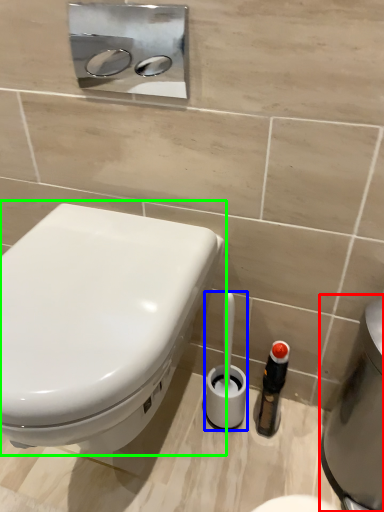
Question: Estimate the real-world distances between objects in this image. Which object is closer to water heater (highlighted by a red box), brush (highlighted by a blue box) or toilet (highlighted by a green box)?

Choices:
 (A) brush
 (B) toilet

Answer: (A)